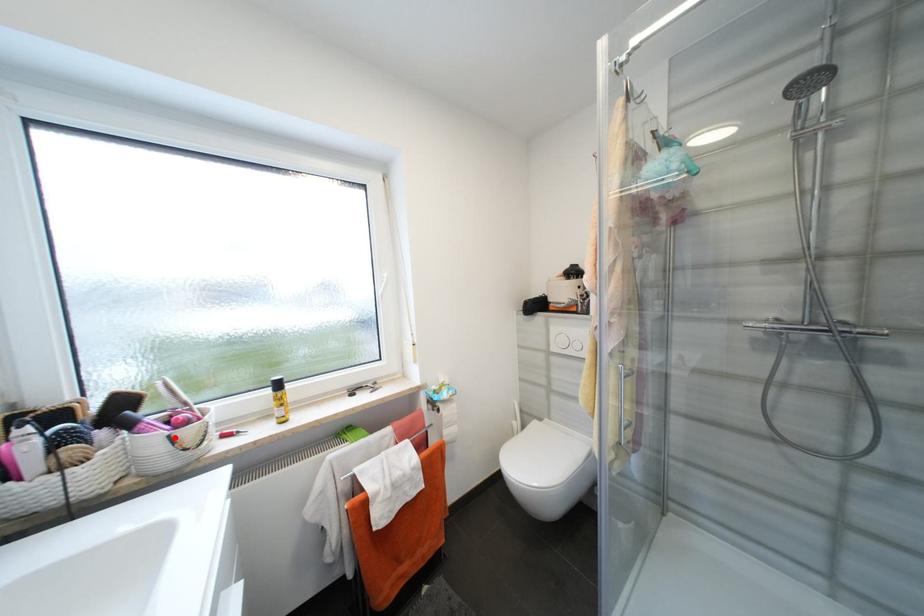
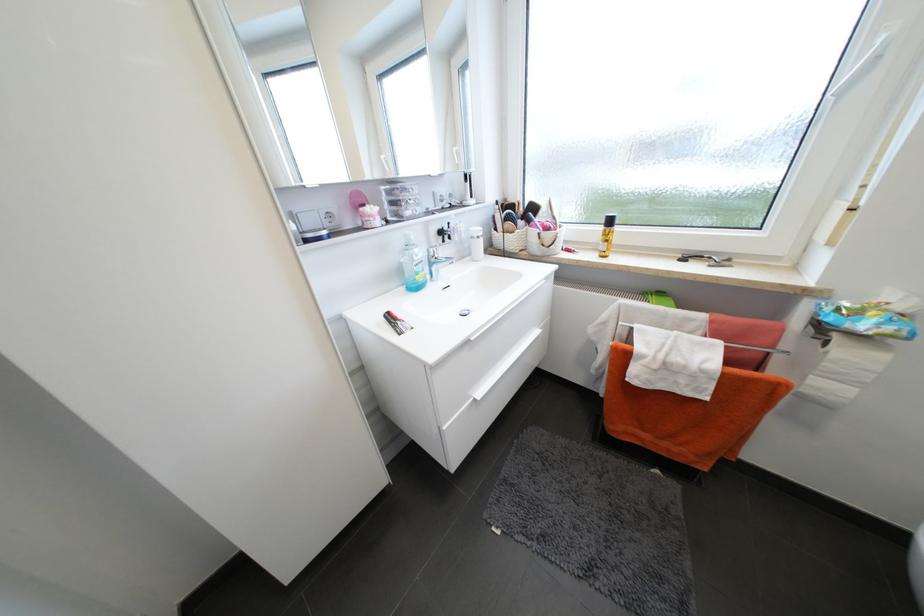
Question: I am providing you with two images of the same scene from different viewpoints. In image1, a red point is highlighted. Considering the same 3D point in image2, which of the following is correct?

Choices:
 (A) It is closer
 (B) It is farther

Answer: (A)